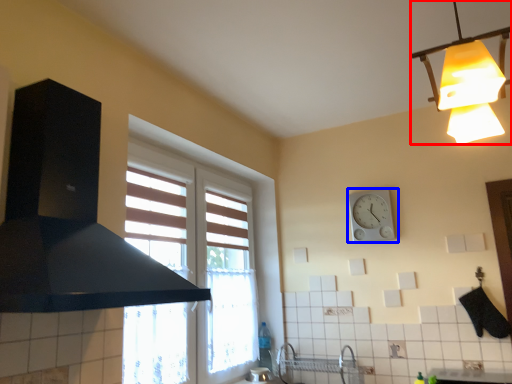
Question: Which object appears closest to the camera in this image, lamp (highlighted by a red box) or wall clock (highlighted by a blue box)?

Choices:
 (A) lamp
 (B) wall clock

Answer: (A)